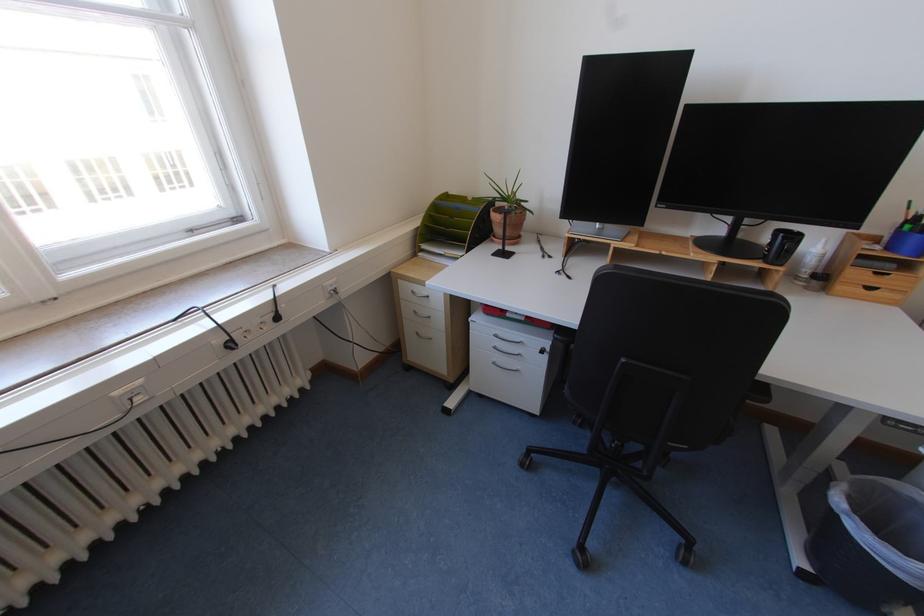
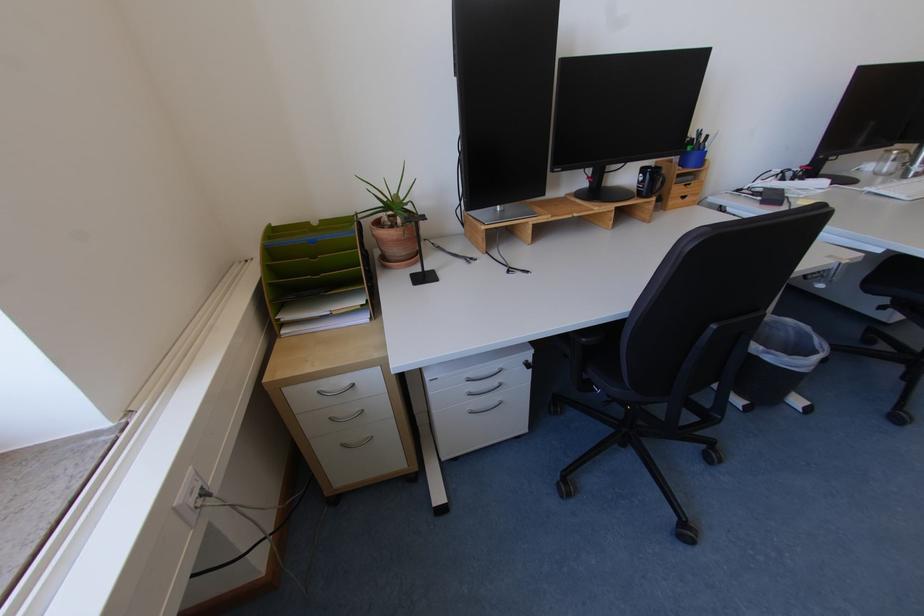
Where in the second image is the point corresponding to (786,233) from the first image?

(650, 171)